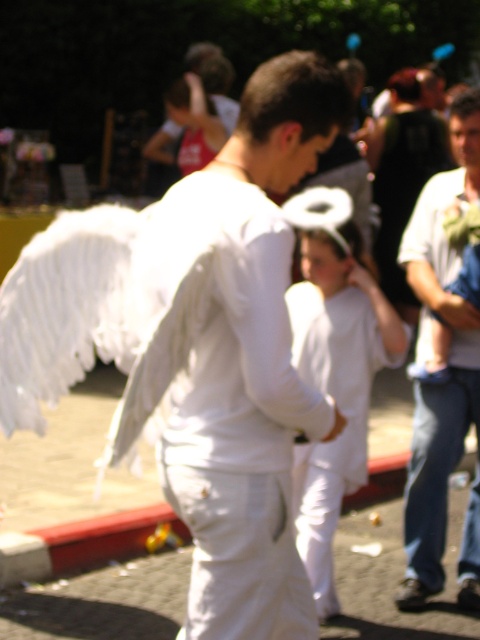
Question: Is white cotton shirt at center to the left of white matte/soft robe at center from the viewer's perspective?

Choices:
 (A) no
 (B) yes

Answer: (A)

Question: Observing the image, what is the correct spatial positioning of white cotton shirt at center in reference to black fabric hair at upper center?

Choices:
 (A) right
 (B) left

Answer: (B)

Question: Which of these objects is positioned closest to the white matte wings at center?

Choices:
 (A) black fabric hair at upper center
 (B) white cotton shirt at center

Answer: (B)

Question: Which object appears closest to the camera in this image?

Choices:
 (A) white matte/soft robe at center
 (B) white cotton shirt at center
 (C) black fabric hair at upper center

Answer: (A)

Question: Which object appears farthest from the camera in this image?

Choices:
 (A) white matte wings at center
 (B) black fabric hair at upper center
 (C) white matte/soft robe at center

Answer: (B)

Question: In this image, where is white cotton shirt at center located relative to white matte/soft robe at center?

Choices:
 (A) above
 (B) below

Answer: (A)